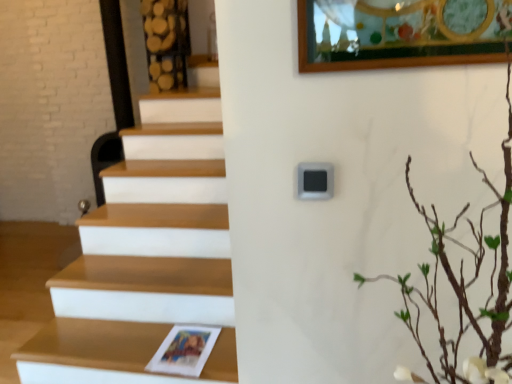
Question: Is point coord(36,359) closer or farther from the camera than point coord(462,289)?

Choices:
 (A) closer
 (B) farther

Answer: (B)

Question: From a real-world perspective, is wooden at lower left physically located above or below green leafy branches at upper right?

Choices:
 (A) below
 (B) above

Answer: (A)

Question: Is wooden at lower left wider or thinner than green leafy branches at upper right?

Choices:
 (A) wide
 (B) thin

Answer: (B)

Question: Considering their positions, is green leafy branches at upper right located in front of or behind wooden at lower left?

Choices:
 (A) behind
 (B) front

Answer: (B)

Question: From a real-world perspective, is green leafy branches at upper right positioned above or below wooden at lower left?

Choices:
 (A) below
 (B) above

Answer: (B)

Question: From the image's perspective, is green leafy branches at upper right positioned above or below wooden at lower left?

Choices:
 (A) above
 (B) below

Answer: (A)

Question: Considering the positions of point (508, 66) and point (224, 379), is point (508, 66) closer or farther from the camera than point (224, 379)?

Choices:
 (A) farther
 (B) closer

Answer: (B)